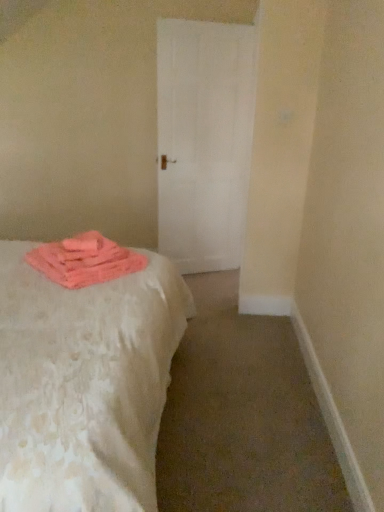
In the scene shown: What is the approximate width of white matte door at center?

white matte door at center is 5.80 inches in width.

You are a GUI agent. You are given a task and a screenshot of the screen. Output one action in this format:
    pyautogui.click(x=<x>, y=<y>)
    Task: Click on the white textured bed at left
    
    Given the screenshot: What is the action you would take?
    point(84,384)

Can you tell me how much pink fluffy towel at lower left and white textured bed at left differ in facing direction?

The facing directions of pink fluffy towel at lower left and white textured bed at left are 134 degrees apart.

From a real-world perspective, who is located higher, pink fluffy towel at lower left or white textured bed at left?

pink fluffy towel at lower left.

Which is closer to the camera, (56, 259) or (92, 447)?

Point (56, 259) is farther from the camera than point (92, 447).

Could you tell me if pink fluffy towel at lower left is turned towards white textured bed at left?

Yes, pink fluffy towel at lower left is turned towards white textured bed at left.

From a real-world perspective, which object stands above the other?

white matte door at center, from a real-world perspective.

Which object is further away from the camera taking this photo, pink fluffy towel at lower left or white matte door at center?

white matte door at center is behind.

What's the angular difference between pink fluffy towel at lower left and white matte door at center's facing directions?

68.6 degrees separate the facing orientations of pink fluffy towel at lower left and white matte door at center.

Is white textured bed at left far away from white matte door at center?

Yes.

Does white textured bed at left have a lesser width compared to white matte door at center?

Incorrect, the width of white textured bed at left is not less than that of white matte door at center.

Considering the positions of objects white textured bed at left and white matte door at center in the image provided, who is more to the right, white textured bed at left or white matte door at center?

white matte door at center.

From the image's perspective, is white textured bed at left located above or below white matte door at center?

white textured bed at left is below white matte door at center.

Can you confirm if white matte door at center is taller than white textured bed at left?

Yes.

Would you say white matte door at center contains white textured bed at left?

No, white textured bed at left is not a part of white matte door at center.

Is point (178, 160) less distant than point (28, 389)?

No, (178, 160) is behind (28, 389).

From a real-world perspective, is white matte door at center below white textured bed at left?

Incorrect, from a real-world perspective, white matte door at center is higher than white textured bed at left.

Is white matte door at center far away from pink fluffy towel at lower left?

white matte door at center is far away from pink fluffy towel at lower left.

Between point (232, 160) and point (78, 245), which one is positioned in front?

The point (78, 245) is more forward.

You are a GUI agent. You are given a task and a screenshot of the screen. Output one action in this format:
    pyautogui.click(x=<x>, y=<y>)
    Task: Click on the material that is on the left side of white matte door at center
    The width and height of the screenshot is (384, 512).
    Given the screenshot: What is the action you would take?
    pyautogui.click(x=85, y=260)

Can you confirm if white matte door at center is thinner than pink fluffy towel at lower left?

Indeed, white matte door at center has a lesser width compared to pink fluffy towel at lower left.

From the image's perspective, does white textured bed at left appear lower than pink fluffy towel at lower left?

Yes.

Considering the relative sizes of white textured bed at left and pink fluffy towel at lower left in the image provided, is white textured bed at left wider than pink fluffy towel at lower left?

Yes, white textured bed at left is wider than pink fluffy towel at lower left.

The height and width of the screenshot is (512, 384). What are the coordinates of `bed below the pink fluffy towel at lower left (from a real-world perspective)` in the screenshot? It's located at (84, 384).

This screenshot has height=512, width=384. I want to click on bed lying below the pink fluffy towel at lower left (from the image's perspective), so click(84, 384).

The image size is (384, 512). In order to click on door that appears above the pink fluffy towel at lower left (from a real-world perspective) in this screenshot , I will do `click(204, 141)`.

From the image, which object appears to be nearer to pink fluffy towel at lower left, white textured bed at left or white matte door at center?

white textured bed at left is positioned closer to the anchor pink fluffy towel at lower left.

Estimate the real-world distances between objects in this image. Which object is closer to white matte door at center, pink fluffy towel at lower left or white textured bed at left?

pink fluffy towel at lower left is positioned closer to the anchor white matte door at center.

Which object lies further to the anchor point white textured bed at left, white matte door at center or pink fluffy towel at lower left?

white matte door at center lies further to white textured bed at left than the other object.

Which object lies further to the anchor point white textured bed at left, pink fluffy towel at lower left or white matte door at center?

white matte door at center is positioned further to the anchor white textured bed at left.

Which object lies nearer to the anchor point pink fluffy towel at lower left, white matte door at center or white textured bed at left?

white textured bed at left.

Which object lies nearer to the anchor point white matte door at center, white textured bed at left or pink fluffy towel at lower left?

Based on the image, pink fluffy towel at lower left appears to be nearer to white matte door at center.

At what (x,y) coordinates should I click in order to perform the action: click on material located between white textured bed at left and white matte door at center in the depth direction. Please return your answer as a coordinate pair (x, y). Image resolution: width=384 pixels, height=512 pixels. Looking at the image, I should click on (85, 260).